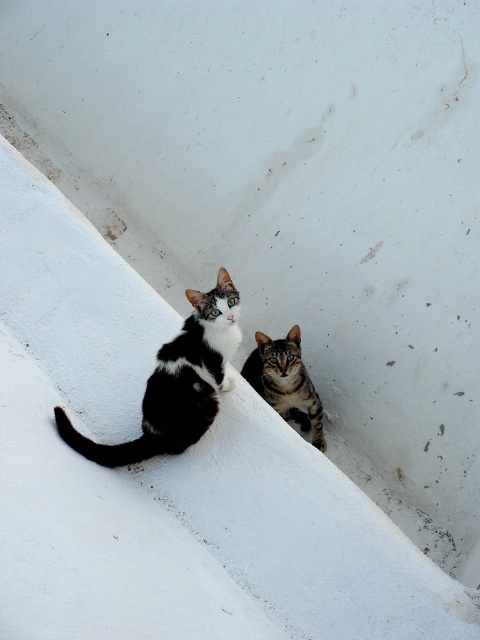
Question: Does black and white fur cat at center have a greater width compared to striped fur cat at center?

Choices:
 (A) no
 (B) yes

Answer: (B)

Question: Which object is closer to the camera taking this photo?

Choices:
 (A) black and white fur cat at center
 (B) striped fur cat at center

Answer: (A)

Question: Is black and white fur cat at center thinner than striped fur cat at center?

Choices:
 (A) no
 (B) yes

Answer: (A)

Question: Is black and white fur cat at center further to camera compared to striped fur cat at center?

Choices:
 (A) yes
 (B) no

Answer: (B)

Question: Which object is closer to the camera taking this photo?

Choices:
 (A) black and white fur cat at center
 (B) striped fur cat at center

Answer: (A)